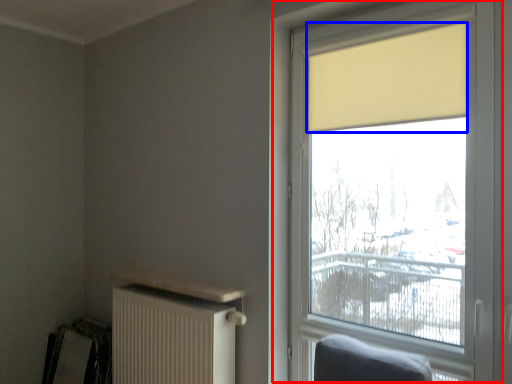
Question: Which object appears farthest to the camera in this image, window (highlighted by a red box) or curtain (highlighted by a blue box)?

Choices:
 (A) window
 (B) curtain

Answer: (B)